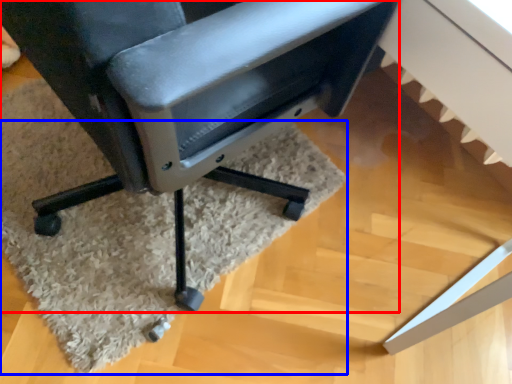
Question: Which object is closer to the camera taking this photo, chair (highlighted by a red box) or mat (highlighted by a blue box)?

Choices:
 (A) chair
 (B) mat

Answer: (A)